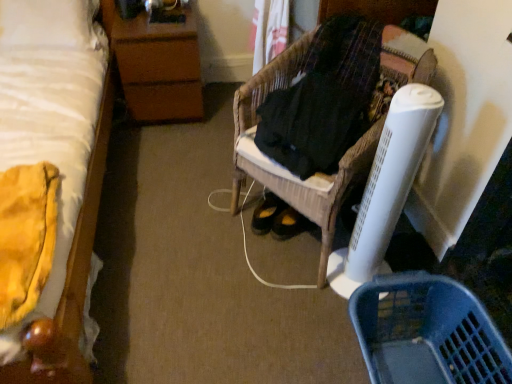
Question: Would you say white soft bed at left is outside woven wood chair at center?

Choices:
 (A) yes
 (B) no

Answer: (A)

Question: Is woven wood chair at center a part of white soft bed at left?

Choices:
 (A) no
 (B) yes

Answer: (A)

Question: From the image's perspective, is white soft bed at left located above woven wood chair at center?

Choices:
 (A) no
 (B) yes

Answer: (B)

Question: Is white soft bed at left positioned behind woven wood chair at center?

Choices:
 (A) no
 (B) yes

Answer: (A)

Question: Can you confirm if white soft bed at left is smaller than woven wood chair at center?

Choices:
 (A) yes
 (B) no

Answer: (B)

Question: Is white soft bed at left at the left side of woven wood chair at center?

Choices:
 (A) yes
 (B) no

Answer: (A)

Question: Is woven wood chair at center to the right of blue plastic basket at lower right from the viewer's perspective?

Choices:
 (A) yes
 (B) no

Answer: (B)

Question: From a real-world perspective, is woven wood chair at center located beneath blue plastic basket at lower right?

Choices:
 (A) yes
 (B) no

Answer: (B)

Question: Can you confirm if woven wood chair at center is thinner than blue plastic basket at lower right?

Choices:
 (A) yes
 (B) no

Answer: (B)

Question: From the image's perspective, would you say woven wood chair at center is positioned over blue plastic basket at lower right?

Choices:
 (A) yes
 (B) no

Answer: (A)

Question: From the image's perspective, does woven wood chair at center appear lower than blue plastic basket at lower right?

Choices:
 (A) yes
 (B) no

Answer: (B)

Question: Is woven wood chair at center smaller than blue plastic basket at lower right?

Choices:
 (A) no
 (B) yes

Answer: (A)

Question: Is brown wood nightstand at upper left to the left of woven wood chair at center from the viewer's perspective?

Choices:
 (A) no
 (B) yes

Answer: (B)